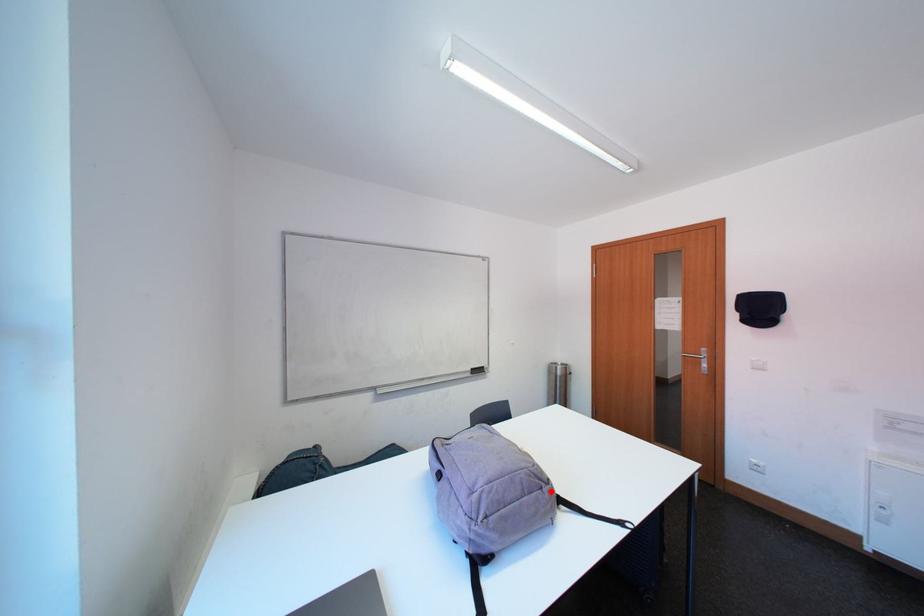
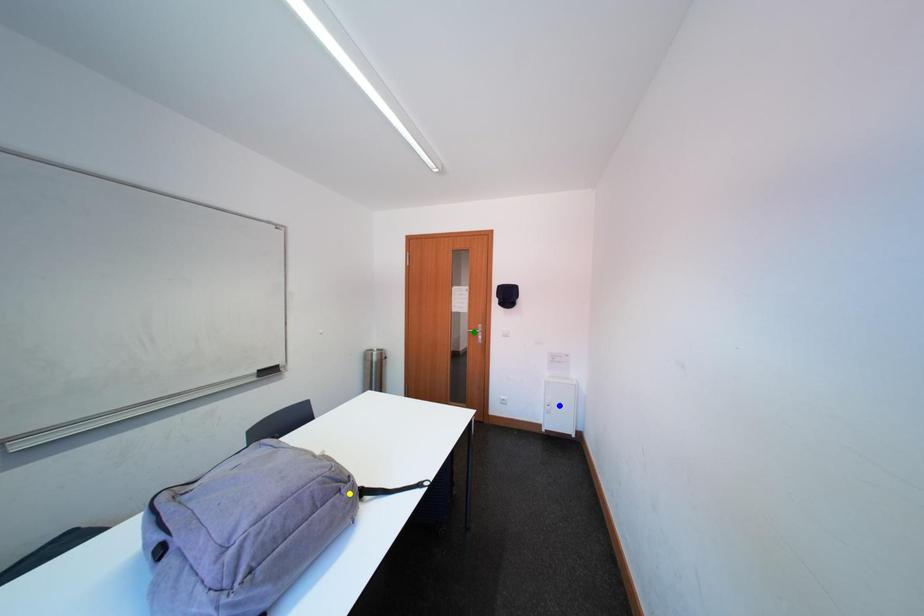
Question: I am providing you with two images of the same scene from different viewpoints. A red point is marked on the first image. You are given multiple points on the second image. Can you choose the point in image 2 that corresponds to the point in image 1?

Choices:
 (A) yellow point
 (B) blue point
 (C) green point

Answer: (A)